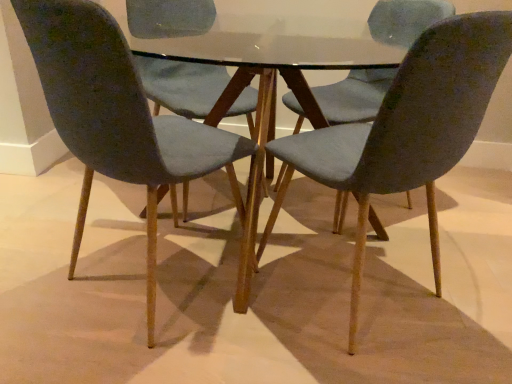
Where is `free space to the left of matte gray chair at left, the first chair viewed from the left`? Image resolution: width=512 pixels, height=384 pixels. free space to the left of matte gray chair at left, the first chair viewed from the left is located at coordinates (47, 258).